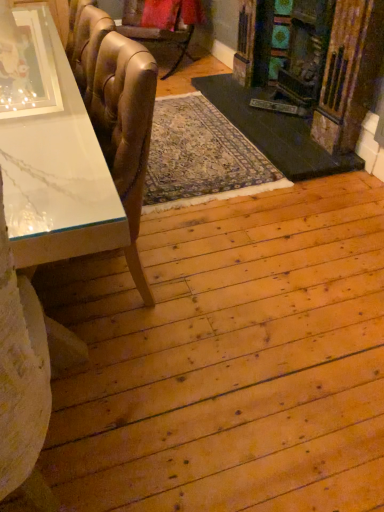
Question: From a real-world perspective, is leather at left, the first chair ordered from the bottom, positioned above or below leather-like gold chair at upper left, marked as the first chair in a top-to-bottom arrangement?

Choices:
 (A) above
 (B) below

Answer: (A)

Question: In terms of width, does leather at left, the first chair ordered from the bottom, look wider or thinner when compared to leather-like gold chair at upper left, marked as the first chair in a top-to-bottom arrangement?

Choices:
 (A) thin
 (B) wide

Answer: (A)

Question: Based on their relative distances, which object is nearer to the leather at left, the second chair in the back-to-front sequence?

Choices:
 (A) leather-like gold chair at upper left, acting as the second chair starting from the front
 (B) white marble table at left
 (C) wooden fireplace at right

Answer: (B)

Question: Based on their relative distances, which object is nearer to the leather-like gold chair at upper left, marked as the first chair in a top-to-bottom arrangement?

Choices:
 (A) white marble table at left
 (B) wooden fireplace at right
 (C) leather at left, positioned as the second chair in top-to-bottom order

Answer: (B)